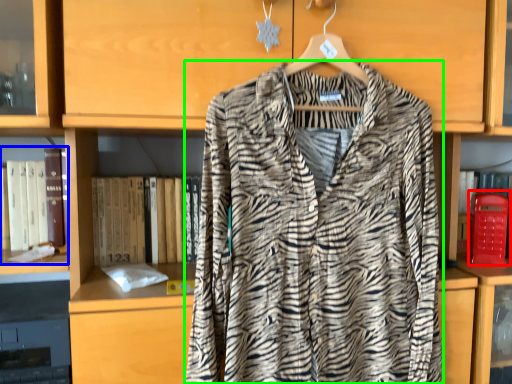
Question: Which object is the closest to the phone box (highlighted by a red box)? Choose among these: book (highlighted by a blue box) or fancy dress (highlighted by a green box).

Choices:
 (A) book
 (B) fancy dress

Answer: (B)